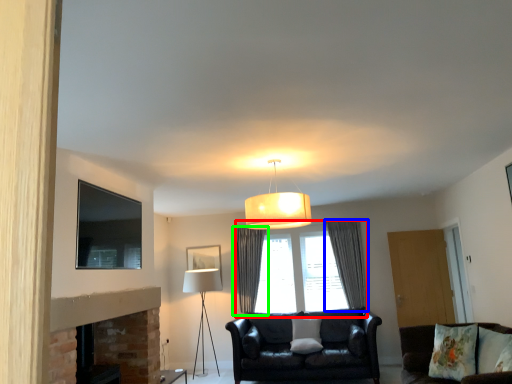
Question: Considering the real-world distances, which object is farthest from window (highlighted by a red box)? curtain (highlighted by a blue box) or curtain (highlighted by a green box)?

Choices:
 (A) curtain
 (B) curtain

Answer: (B)